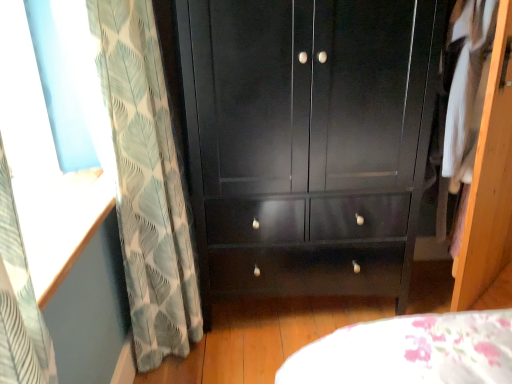
Question: In terms of size, does white fabric at right appear bigger or smaller than glossy black cupboard at center?

Choices:
 (A) big
 (B) small

Answer: (B)

Question: Looking at their shapes, would you say white fabric at right is wider or thinner than glossy black cupboard at center?

Choices:
 (A) thin
 (B) wide

Answer: (A)

Question: Which object is positioned farthest from the glossy black cupboard at center?

Choices:
 (A) green leaf-patterned curtain at left
 (B) white fabric at right

Answer: (B)

Question: Estimate the real-world distances between objects in this image. Which object is closer to the white fabric at right?

Choices:
 (A) glossy black cupboard at center
 (B) green leaf-patterned curtain at left

Answer: (A)